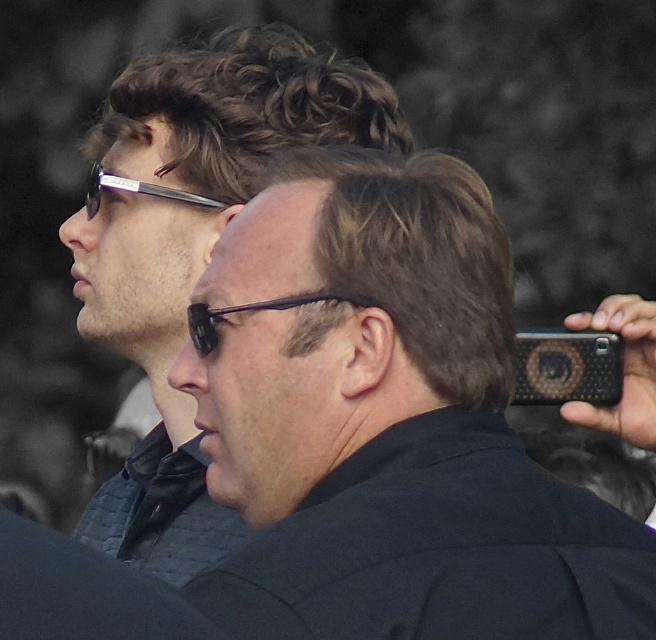
Between black plastic glasses at center and matte black goggles at upper left, which one is positioned higher?

Positioned higher is matte black goggles at upper left.

Find the location of a particular element. The image size is (656, 640). black plastic glasses at center is located at coordinates (249, 310).

Which is behind, point (211, 323) or point (89, 205)?

The point (89, 205) is behind.

Image resolution: width=656 pixels, height=640 pixels. What are the coordinates of `black plastic glasses at center` in the screenshot? It's located at (249, 310).

Can you confirm if matte black sunglasses at upper left is shorter than matte black goggles at upper left?

Incorrect, matte black sunglasses at upper left's height does not fall short of matte black goggles at upper left's.

Does point (241, 138) come farther from viewer compared to point (91, 170)?

That is False.

Does point (161, 435) come closer to viewer compared to point (89, 172)?

Yes.

The height and width of the screenshot is (640, 656). I want to click on matte black sunglasses at upper left, so click(192, 250).

Who is positioned more to the right, matte black sunglasses at upper left or black plastic glasses at center?

From the viewer's perspective, black plastic glasses at center appears more on the right side.

Is matte black sunglasses at upper left to the left of black plastic glasses at center from the viewer's perspective?

Yes, matte black sunglasses at upper left is to the left of black plastic glasses at center.

Measure the distance between point (403, 141) and camera.

They are 10.23 feet apart.

Find the location of `matte black sunglasses at upper left`. matte black sunglasses at upper left is located at coordinates (192, 250).